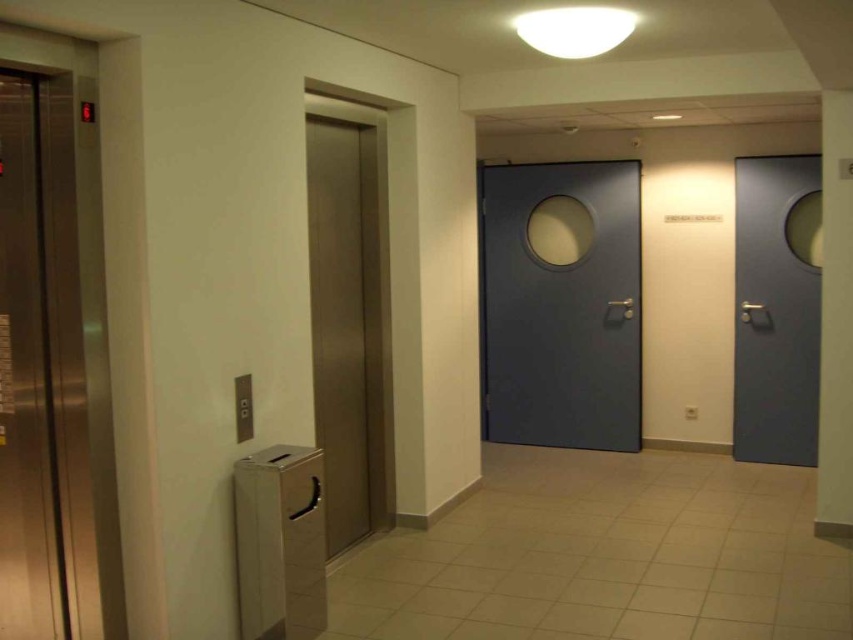
You are a delivery person carrying a large package and need to place it in the nearest available storage area. The hallway has a polished stainless steel elevator at left and a metallic silver trash can at lower left. Which object should you approach first based on their proximity to you?

The polished stainless steel elevator at left is closer to the viewer than the metallic silver trash can at lower left, so you should approach the polished stainless steel elevator at left first since it is nearer.

You are standing in the hallway and need to exit through the door. You see a matte gray door at center and a wooden door at center. Which door is higher up?

The matte gray door at center is above the wooden door at center, so you should look up to find the matte gray door at center.